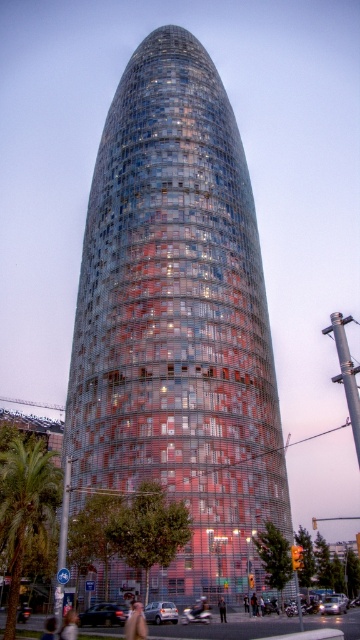
Question: Estimate the real-world distances between objects in this image. Which object is farther from the glassy steel tower at center?

Choices:
 (A) dark gray suit at center
 (B) green leafy palm tree at lower left

Answer: (A)

Question: Is glassy steel tower at center positioned before green leafy palm tree at lower left?

Choices:
 (A) no
 (B) yes

Answer: (A)

Question: Can you confirm if glassy steel tower at center is positioned to the left of dark gray suit at center?

Choices:
 (A) no
 (B) yes

Answer: (B)

Question: Which object is closer to the camera taking this photo?

Choices:
 (A) green leafy palm tree at lower left
 (B) dark gray suit at center

Answer: (A)

Question: Which point is farther to the camera?

Choices:
 (A) dark gray suit at center
 (B) glassy steel tower at center

Answer: (A)

Question: Is green leafy palm tree at lower left thinner than dark gray suit at center?

Choices:
 (A) no
 (B) yes

Answer: (A)